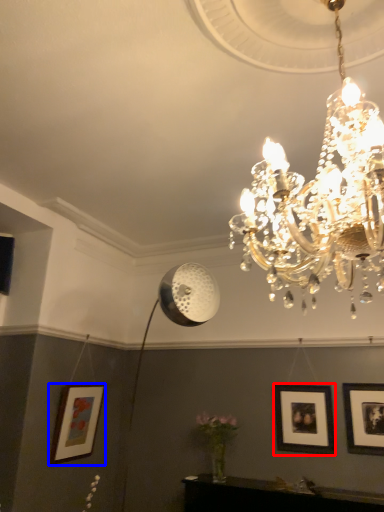
Question: Which of the following is the closest to the observer, picture frame (highlighted by a red box) or picture frame (highlighted by a blue box)?

Choices:
 (A) picture frame
 (B) picture frame

Answer: (A)